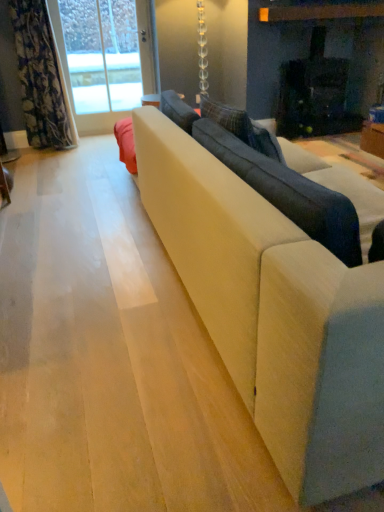
Locate an element on the screen. free space to the left of suede-like beige couch at center is located at coordinates (87, 273).